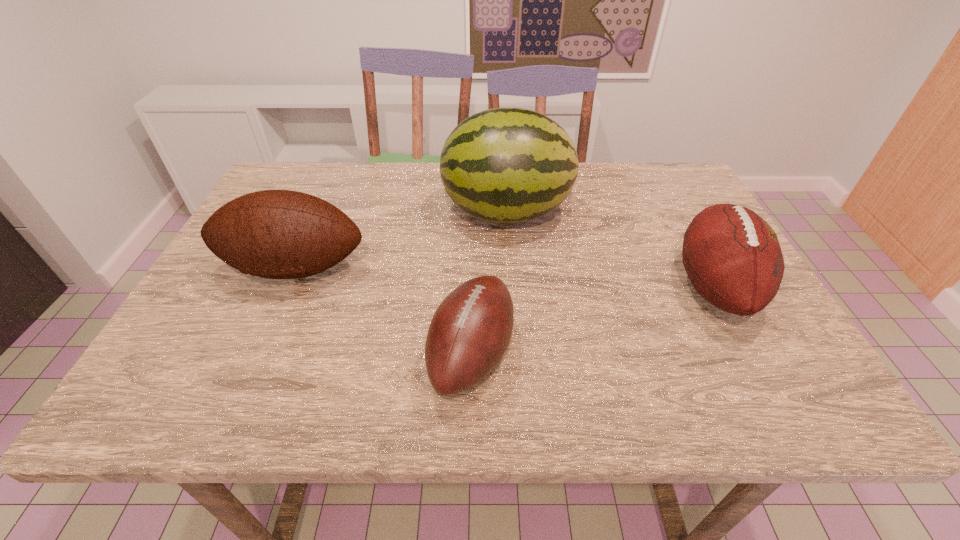
I want to click on vacant region that satisfies the following two spatial constraints: 1. at the stem end of the tallest object; 2. on the laces of the leftmost football (American), so click(511, 268).